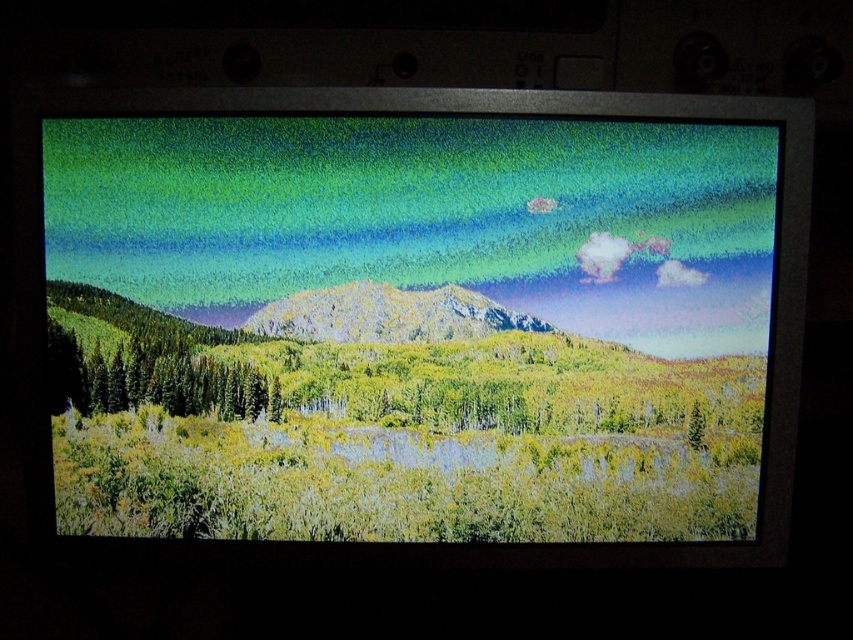
You are a photographer trying to capture the green matte trees at left and the rocky mountain at center in the same frame. Based on their positions, which object would appear closer to the camera in the photo?

The green matte trees at left appear closer to the camera because they are positioned below the rocky mountain at center, indicating they are in the foreground.

You are an interior designer assessing the TV placement in a living room. The TV screen shows a landscape with green matte trees at left and green matte landscape at center. Which object on the TV screen occupies more horizontal space?

The green matte landscape at center occupies more horizontal space as its width is larger than the green matte trees at left.